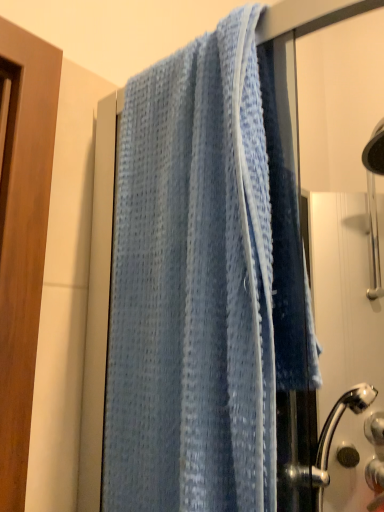
Question: Considering the positions of point pyautogui.click(x=372, y=437) and point pyautogui.click(x=327, y=208), is point pyautogui.click(x=372, y=437) closer or farther from the camera than point pyautogui.click(x=327, y=208)?

Choices:
 (A) farther
 (B) closer

Answer: (B)

Question: From their relative heights in the image, would you say satin silver knob at lower right, which appears as the first knob when viewed from the right, is taller or shorter than blue fabric towel at right?

Choices:
 (A) tall
 (B) short

Answer: (B)

Question: Estimate the real-world distances between objects in this image. Which object is closer to the matte black knob at lower right, acting as the second knob starting from the right?

Choices:
 (A) blue fabric towel at right
 (B) light blue waffle-textured towel at center
 (C) satin silver knob at lower right, positioned as the second knob in left-to-right order

Answer: (C)

Question: Which of these objects is positioned farthest from the light blue waffle-textured towel at center?

Choices:
 (A) blue fabric towel at right
 (B) matte black knob at lower right, the first knob viewed from the left
 (C) satin silver knob at lower right, positioned as the second knob in left-to-right order

Answer: (C)